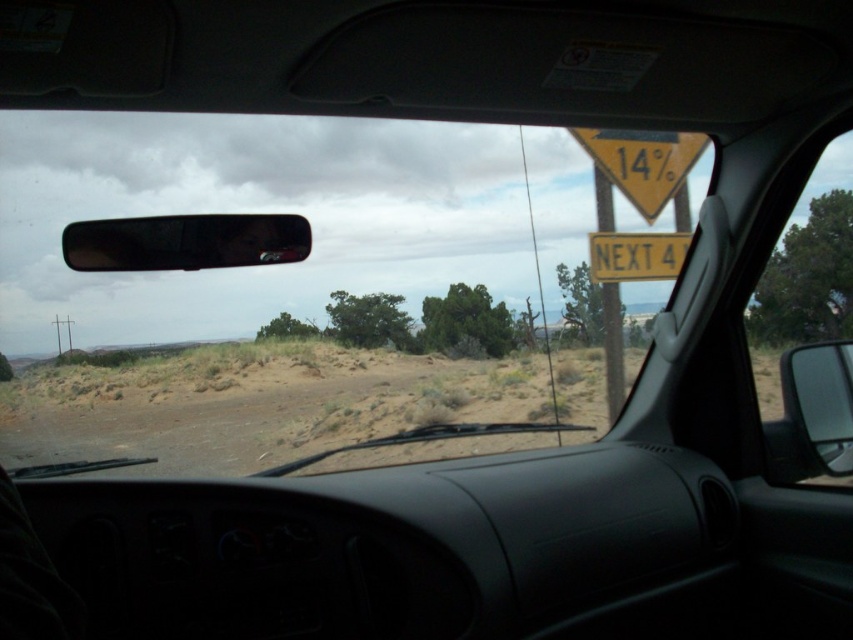
Who is more forward, (x=593, y=412) or (x=653, y=189)?

Point (x=653, y=189) is in front.

Can you confirm if brown sandy dirt field at center is positioned to the left of yellow/yellowish metal sign at upper right?

Correct, you'll find brown sandy dirt field at center to the left of yellow/yellowish metal sign at upper right.

Which is behind, point (131, 429) or point (633, 161)?

The point (131, 429) is more distant.

Where is `brown sandy dirt field at center`? The width and height of the screenshot is (853, 640). brown sandy dirt field at center is located at coordinates (277, 403).

Between point (801, 337) and point (634, 179), which one is positioned in front?

Point (634, 179) is in front.

This screenshot has height=640, width=853. What do you see at coordinates (807, 252) in the screenshot?
I see `transparent glass car window at right` at bounding box center [807, 252].

Is point (775, 289) farther from viewer compared to point (643, 182)?

Yes, it is.

What are the coordinates of `transparent glass car window at right` in the screenshot? It's located at (807, 252).

Who is positioned more to the left, brown sandy dirt field at center or transparent glass car window at right?

brown sandy dirt field at center

How distant is brown sandy dirt field at center from transparent glass car window at right?

brown sandy dirt field at center is 8.71 meters from transparent glass car window at right.

Does point (277, 464) lie behind point (747, 323)?

No, it is in front of (747, 323).

Locate an element on the screen. The width and height of the screenshot is (853, 640). brown sandy dirt field at center is located at coordinates (277, 403).